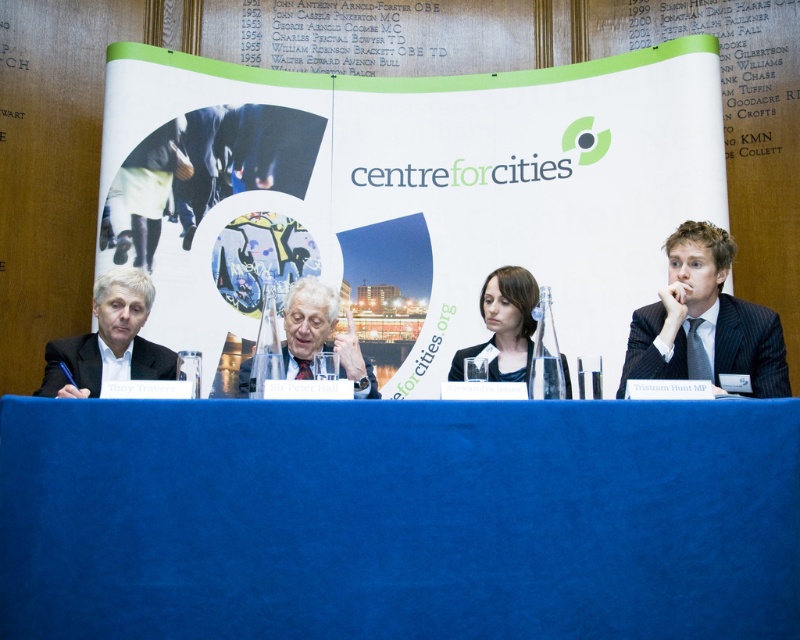
The height and width of the screenshot is (640, 800). Identify the location of dark blue suit at right. pyautogui.click(x=706, y=323).

Is dark blue suit at right closer to the viewer compared to matte black suit at center?

That is True.

Where is `dark blue suit at right`? dark blue suit at right is located at coordinates (706, 323).

Is blue fabric table at center below white shirt at left?

Indeed, blue fabric table at center is positioned under white shirt at left.

Does blue fabric table at center appear on the left side of white shirt at left?

Incorrect, blue fabric table at center is not on the left side of white shirt at left.

Is point (186, 449) less distant than point (124, 285)?

Yes, it is in front of point (124, 285).

Where is `blue fabric table at center`? Image resolution: width=800 pixels, height=640 pixels. blue fabric table at center is located at coordinates (398, 518).

Is white shirt at left to the right of matte black hair at center from the viewer's perspective?

Incorrect, white shirt at left is not on the right side of matte black hair at center.

From the picture: Does white shirt at left have a lesser height compared to matte black hair at center?

Yes.

Between point (138, 296) and point (488, 371), which one is positioned in front?

Point (488, 371) is more forward.

Where is `white shirt at left`? white shirt at left is located at coordinates (110, 340).